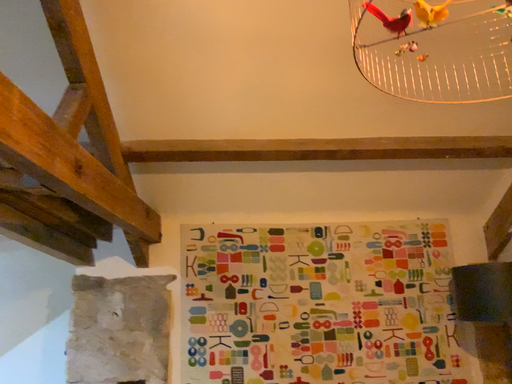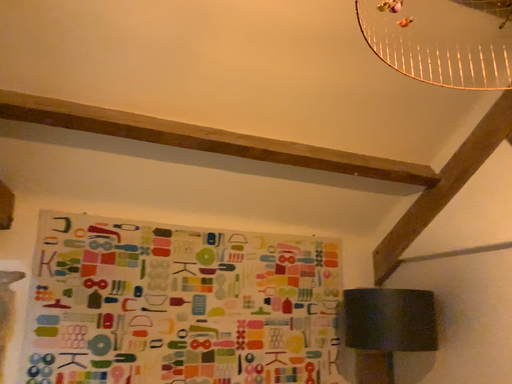
Question: Which way did the camera rotate in the video?

Choices:
 (A) rotated right
 (B) rotated left

Answer: (A)